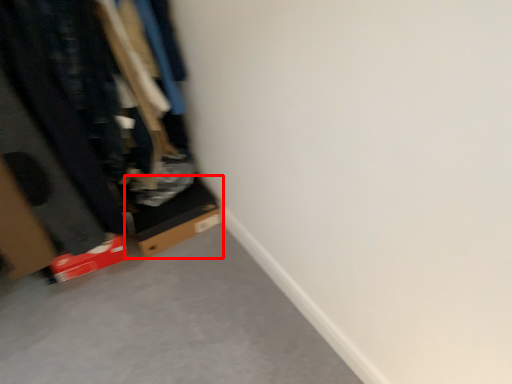
Question: From the image's perspective, what is the correct spatial relationship of cardboard box (annotated by the red box) in relation to closet?

Choices:
 (A) below
 (B) above

Answer: (A)